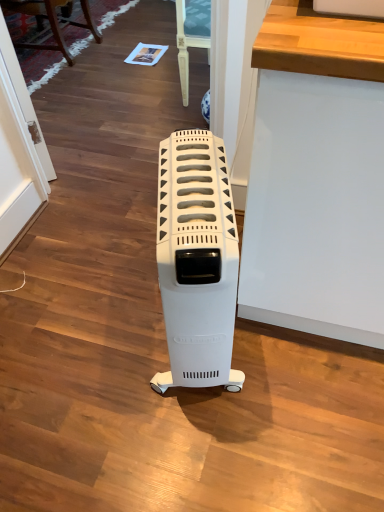
What is the approximate width of white plastic heater at center?

It is 17.08 inches.

Find the location of a particular element. Image resolution: width=384 pixels, height=512 pixels. white plastic heater at center is located at coordinates (197, 262).

What do you see at coordinates (197, 262) in the screenshot? The image size is (384, 512). I see `white plastic heater at center` at bounding box center [197, 262].

The image size is (384, 512). What do you see at coordinates (52, 21) in the screenshot?
I see `wooden chair at upper left` at bounding box center [52, 21].

Identify the location of wooden chair at upper left. (52, 21).

Find the location of `white plastic heater at center`. white plastic heater at center is located at coordinates (197, 262).

In the image, is wooden chair at upper left on the left side or the right side of white plastic heater at center?

Clearly, wooden chair at upper left is on the left of white plastic heater at center in the image.

Which is behind, wooden chair at upper left or white plastic heater at center?

wooden chair at upper left.

Is point (8, 2) closer to camera compared to point (226, 320)?

No.

From the image's perspective, is wooden chair at upper left beneath white plastic heater at center?

No, from the image's perspective, wooden chair at upper left is not beneath white plastic heater at center.

From a real-world perspective, does wooden chair at upper left sit lower than white plastic heater at center?

Yes.

Can you confirm if wooden chair at upper left is wider than white plastic heater at center?

Indeed, wooden chair at upper left has a greater width compared to white plastic heater at center.

Which of these two, wooden chair at upper left or white plastic heater at center, stands shorter?

wooden chair at upper left is shorter.

Who is smaller, wooden chair at upper left or white plastic heater at center?

white plastic heater at center.

Is wooden chair at upper left surrounding white plastic heater at center?

That's incorrect, white plastic heater at center is not inside wooden chair at upper left.

Is wooden chair at upper left next to white plastic heater at center and touching it?

No, wooden chair at upper left is not making contact with white plastic heater at center.

Could you tell me if wooden chair at upper left is facing white plastic heater at center?

No, wooden chair at upper left is not oriented towards white plastic heater at center.

How many degrees apart are the facing directions of wooden chair at upper left and white plastic heater at center?

The facing directions of wooden chair at upper left and white plastic heater at center are 109 degrees apart.

I want to click on furniture behind the white plastic heater at center, so click(x=52, y=21).

In the scene shown: Is white plastic heater at center at the right side of wooden chair at upper left?

Correct, you'll find white plastic heater at center to the right of wooden chair at upper left.

Which object is closer to the camera, white plastic heater at center or wooden chair at upper left?

white plastic heater at center.

Is point (215, 157) closer to camera compared to point (16, 42)?

That is True.

From the image's perspective, does white plastic heater at center appear lower than wooden chair at upper left?

Indeed, from the image's perspective, white plastic heater at center is shown beneath wooden chair at upper left.

From a real-world perspective, is white plastic heater at center over wooden chair at upper left?

Yes.

Does white plastic heater at center have a lesser width compared to wooden chair at upper left?

Correct, the width of white plastic heater at center is less than that of wooden chair at upper left.

Based on the photo, which of these two, white plastic heater at center or wooden chair at upper left, stands taller?

Standing taller between the two is white plastic heater at center.

Is white plastic heater at center bigger than wooden chair at upper left?

No.

Is white plastic heater at center outside of wooden chair at upper left?

Yes, white plastic heater at center is outside of wooden chair at upper left.

Is white plastic heater at center next to wooden chair at upper left and touching it?

No, white plastic heater at center is not making contact with wooden chair at upper left.

Is white plastic heater at center facing towards wooden chair at upper left?

No, white plastic heater at center is not oriented towards wooden chair at upper left.

Can you tell me how much white plastic heater at center and wooden chair at upper left differ in facing direction?

109 degrees.

What are the coordinates of `furniture on the left of white plastic heater at center` in the screenshot? It's located at (52, 21).

The width and height of the screenshot is (384, 512). I want to click on home appliance below the wooden chair at upper left (from the image's perspective), so [x=197, y=262].

Find the location of a particular element. home appliance in front of the wooden chair at upper left is located at coordinates (197, 262).